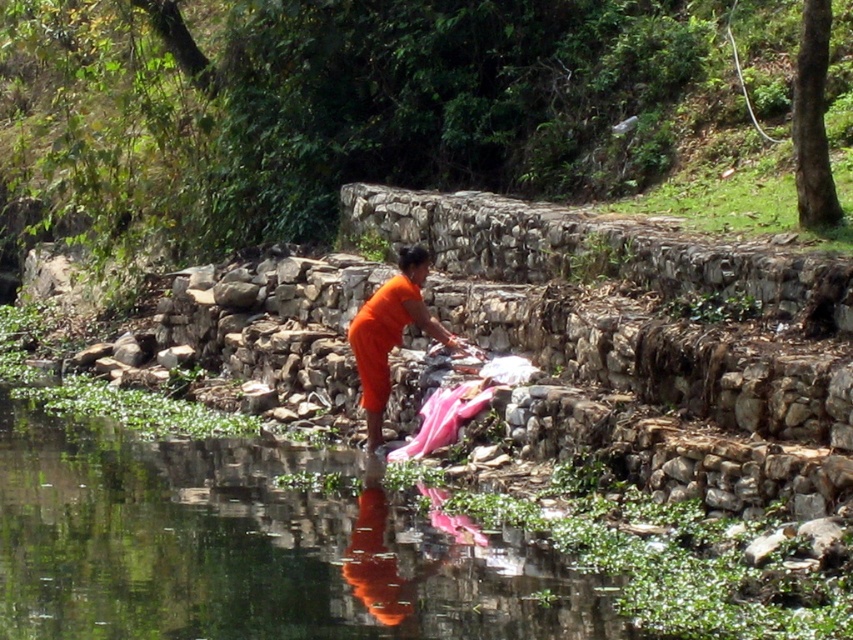
You are a photographer trying to capture the orange fabric at center and the orange matte cloth at center in a single shot. Which object should you focus on first to ensure both are in focus?

You should focus on the orange matte cloth at center first because it is farther away from the viewer than the orange fabric at center, ensuring both will be in focus when focused on the farther object.

You are a tailor trying to decide which orange material to use for a dress that requires a wider piece of fabric. You see the orange fabric at center and the orange matte cloth at center in the scene. Which one should you choose based on their widths?

The orange fabric at center might be wider than orange matte cloth at center, so you should choose the orange fabric at center for the dress that requires a wider piece of fabric.